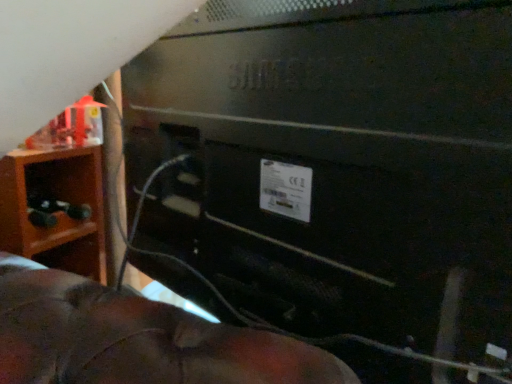
Question: Considering the relative positions of brown wood nightstand at left and black matte wire at center in the image provided, is brown wood nightstand at left to the left or to the right of black matte wire at center?

Choices:
 (A) left
 (B) right

Answer: (A)

Question: Looking at the image, does brown wood nightstand at left seem bigger or smaller compared to black matte wire at center?

Choices:
 (A) big
 (B) small

Answer: (B)

Question: Considering the real-world distances, which object is closest to the black matte wire at center?

Choices:
 (A) brown wood nightstand at left
 (B) matte black toy at left

Answer: (A)

Question: Estimate the real-world distances between objects in this image. Which object is farther from the brown wood nightstand at left?

Choices:
 (A) matte black toy at left
 (B) black matte wire at center

Answer: (B)